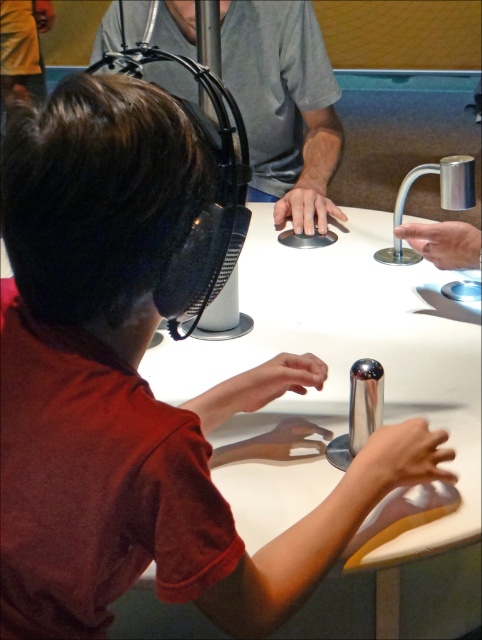
You are a visitor at the science center and you see the matte black headset at upper center and the polished metallic faucet at center. Which object is located to the left when viewed from your perspective?

The matte black headset at upper center is positioned on the left side of the polished metallic faucet at center, so it is located to the left when viewed from your perspective.

You are a researcher analyzing the spatial arrangement of objects in the image. The coordinates provided are normalized between 0 and 1. If the image has a width of 1280 pixels and height of 720 pixels, what are the pixel coordinates of the matte black headset at upper center?

The pixel coordinates of the matte black headset at upper center are calculated by multiplying the normalized coordinates by the image dimensions. The x coordinate is 0.167 multiplied by 1280 pixels, resulting in approximately 213 pixels. The y coordinate is 0.589 multiplied by 720 pixels, resulting in approximately 424 pixels. Therefore, the pixel coordinates are approximately (481, 639).

You are a researcher analyzing the spatial arrangement of the scene. The coordinates given are in a normalized system where the bottom left corner is the origin. Where is the matte black headset at upper center located in terms of its x and y coordinates?

The matte black headset at upper center is located at coordinates x 0.167 and y 0.589.